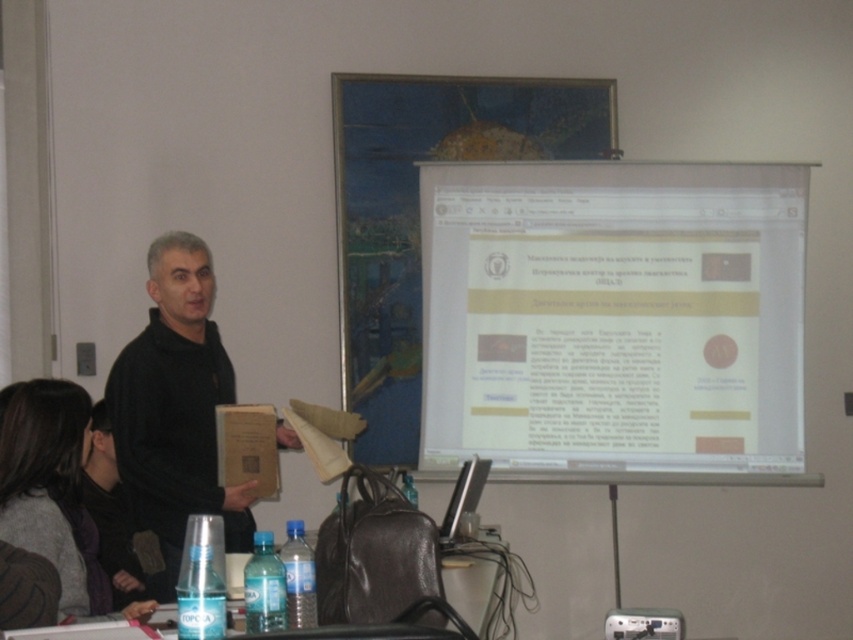
Question: Which point is closer to the camera?

Choices:
 (A) translucent plastic table at lower center
 (B) gray sweater at lower left

Answer: (B)

Question: Which object is farther from the camera taking this photo?

Choices:
 (A) black matte sweater at center
 (B) gray sweater at lower left
 (C) translucent plastic table at lower center

Answer: (A)

Question: Does gray sweater at lower left have a lesser width compared to translucent plastic table at lower center?

Choices:
 (A) no
 (B) yes

Answer: (A)

Question: Among these objects, which one is farthest from the camera?

Choices:
 (A) gray sweater at lower left
 (B) black matte sweater at center
 (C) translucent plastic table at lower center

Answer: (B)

Question: Where is black matte sweater at center located in relation to translucent plastic table at lower center in the image?

Choices:
 (A) above
 (B) below

Answer: (A)

Question: Can you confirm if black matte sweater at center is positioned to the left of gray sweater at lower left?

Choices:
 (A) no
 (B) yes

Answer: (A)